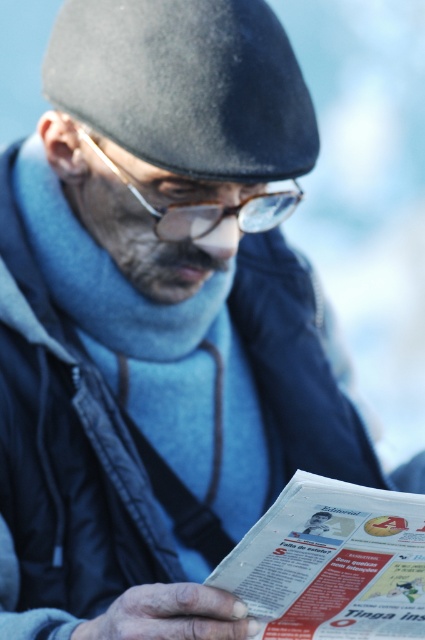
Question: Which point is farther to the camera?

Choices:
 (A) (252, 545)
 (B) (81, 48)
 (C) (181, 218)

Answer: (C)

Question: Does dark gray felt beret at upper center appear on the right side of printed paper at lower center?

Choices:
 (A) yes
 (B) no

Answer: (B)

Question: Among these points, which one is farthest from the camera?

Choices:
 (A) (229, 244)
 (B) (337, 497)

Answer: (A)

Question: Which point is closer to the camera taking this photo?

Choices:
 (A) (221, 244)
 (B) (226, 125)

Answer: (B)

Question: Does dark gray felt beret at upper center have a larger size compared to printed paper at lower center?

Choices:
 (A) no
 (B) yes

Answer: (B)

Question: Is printed paper at lower center to the left of clear plastic glasses at center from the viewer's perspective?

Choices:
 (A) no
 (B) yes

Answer: (A)